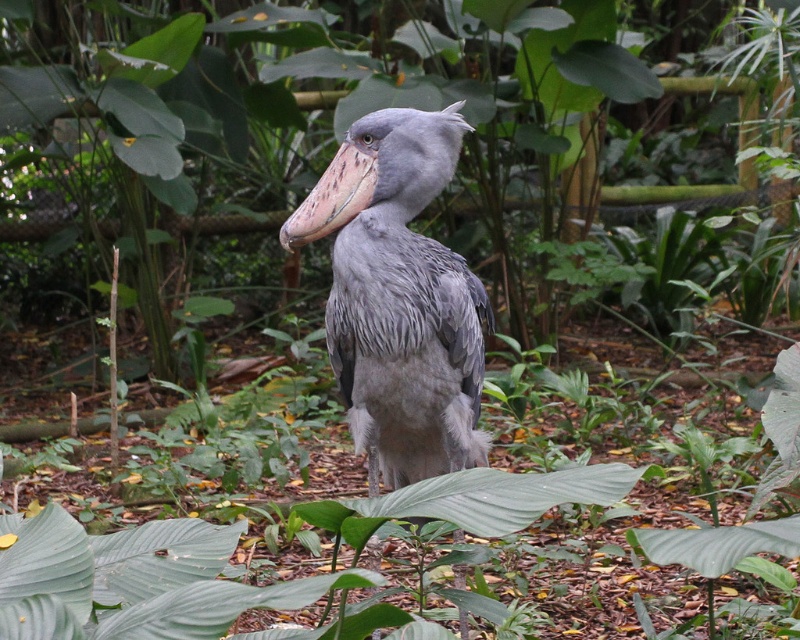
In the scene shown: You are a zookeeper planning to place a feeding station for the gray matte bird at center. The feeding station must be placed exactly at the bird current position. What coordinates should you use for the feeding station?

The feeding station should be placed at coordinates (x=400, y=298), as that is the current position of the gray matte bird at center according to the description.